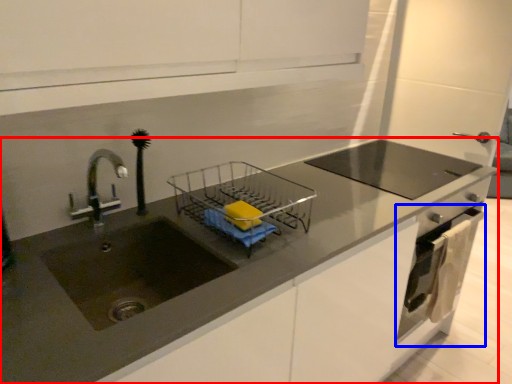
Question: Which object appears closest to the camera in this image, countertop (highlighted by a red box) or oven (highlighted by a blue box)?

Choices:
 (A) countertop
 (B) oven

Answer: (A)